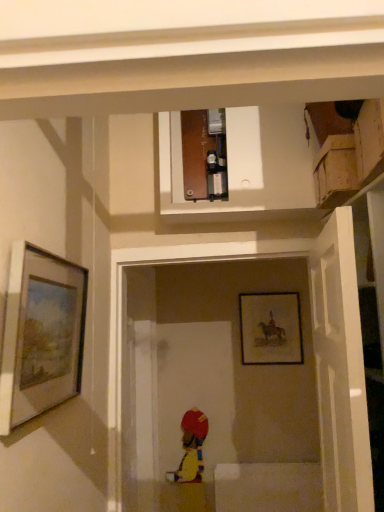
Question: From the image's perspective, is matte black picture frame at center, which is counted as the 2th picture frame, starting from the left, above or below white matte door at right?

Choices:
 (A) below
 (B) above

Answer: (A)

Question: From a real-world perspective, is matte black picture frame at center, the 1th picture frame from the right, positioned above or below white matte door at right?

Choices:
 (A) below
 (B) above

Answer: (B)

Question: Based on their relative distances, which object is farther from the matte black picture frame at center, marked as the 1th picture frame in a back-to-front arrangement?

Choices:
 (A) white matte door at right
 (B) matte silver picture frame at left, positioned as the second picture frame in back-to-front order

Answer: (B)

Question: Which of these objects is positioned farthest from the white matte door at right?

Choices:
 (A) matte silver picture frame at left, the first picture frame in the front-to-back sequence
 (B) matte black picture frame at center, the 1th picture frame from the right

Answer: (B)